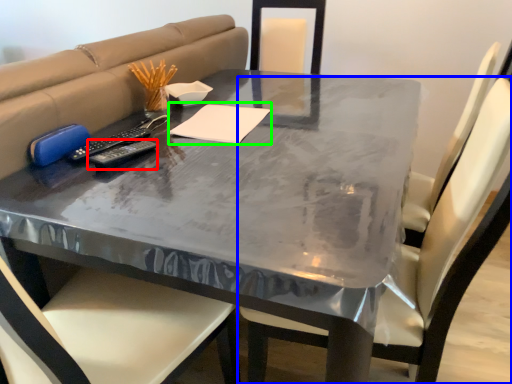
Question: Based on their relative distances, which object is nearer to remote (highlighted by a red box)? Choose from chair (highlighted by a blue box) and notepad (highlighted by a green box).

Choices:
 (A) chair
 (B) notepad

Answer: (B)